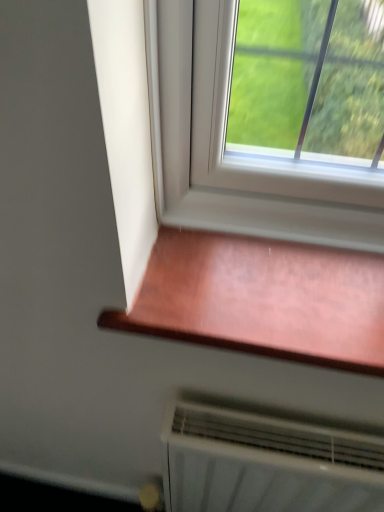
I want to click on empty space that is ontop of wooden at lower right, so click(x=252, y=283).